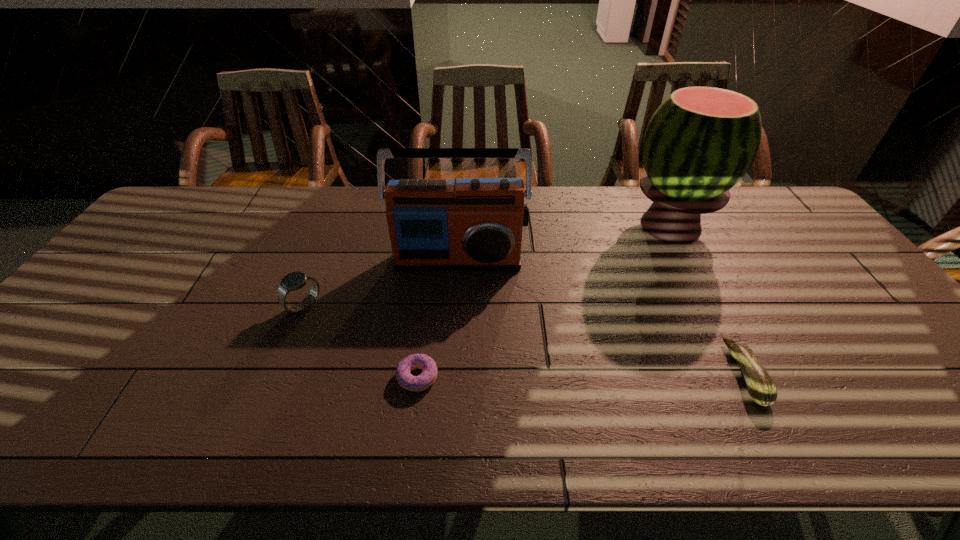
This screenshot has height=540, width=960. I want to click on watermelon, so click(x=699, y=143).

At what (x,y) coordinates should I click in order to perform the action: click on the second tallest object. Please return your answer as a coordinate pair (x, y). Looking at the image, I should click on (465, 224).

You are a GUI agent. You are given a task and a screenshot of the screen. Output one action in this format:
    pyautogui.click(x=<x>, y=<y>)
    Task: Click on the watch
    This screenshot has height=540, width=960.
    Given the screenshot: What is the action you would take?
    pyautogui.click(x=293, y=281)

Identify the location of the third tallest object. The width and height of the screenshot is (960, 540). (293, 281).

Image resolution: width=960 pixels, height=540 pixels. What are the coordinates of `the second shortest object` in the screenshot? It's located at (761, 388).

The height and width of the screenshot is (540, 960). What are the coordinates of `doughnut` in the screenshot? It's located at click(x=421, y=361).

The height and width of the screenshot is (540, 960). I want to click on free region located on the left of the tallest object, so click(x=525, y=226).

This screenshot has height=540, width=960. Identify the location of free space located on the front-facing side of the second tallest object. (456, 292).

Identify the location of vacant position located on the left of the leftmost object. The height and width of the screenshot is (540, 960). (186, 306).

Locate an element on the screen. free spot located at the stem end of the second shortest object is located at coordinates (681, 374).